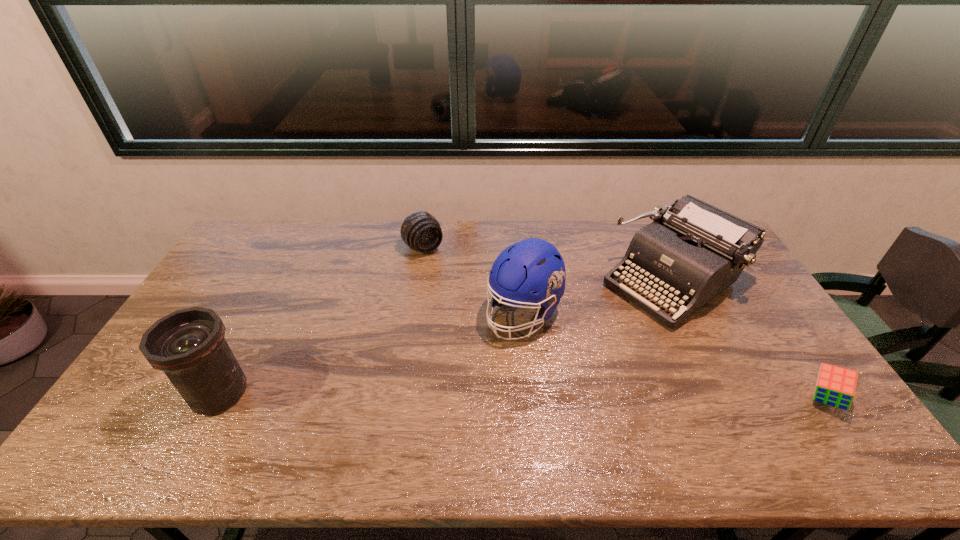
Identify the location of vacant space at the right edge of the desktop. Image resolution: width=960 pixels, height=540 pixels. (733, 300).

Identify the location of free space at the near right corner. (823, 408).

Locate an element on the screen. The image size is (960, 540). free space between the typewriter and the nearer telephoto lens is located at coordinates (445, 337).

The image size is (960, 540). In order to click on vacant point located between the cube and the football helmet in this screenshot , I will do `click(674, 356)`.

Locate an element on the screen. vacant space that's between the football helmet and the farther telephoto lens is located at coordinates (473, 281).

The image size is (960, 540). Identify the location of vacant point located between the football helmet and the nearer telephoto lens. click(x=372, y=353).

At what (x,y) coordinates should I click in order to perform the action: click on free space that is in between the right telephoto lens and the third object from right to left. Please return your answer as a coordinate pair (x, y). The width and height of the screenshot is (960, 540). Looking at the image, I should click on (473, 281).

Where is `vacant area between the football helmet and the second object from left to right`? This screenshot has width=960, height=540. vacant area between the football helmet and the second object from left to right is located at coordinates (473, 281).

What are the coordinates of `free space between the taller telephoto lens and the cube` in the screenshot? It's located at tap(522, 396).

Locate an element on the screen. vacant space that's between the football helmet and the typewriter is located at coordinates (598, 297).